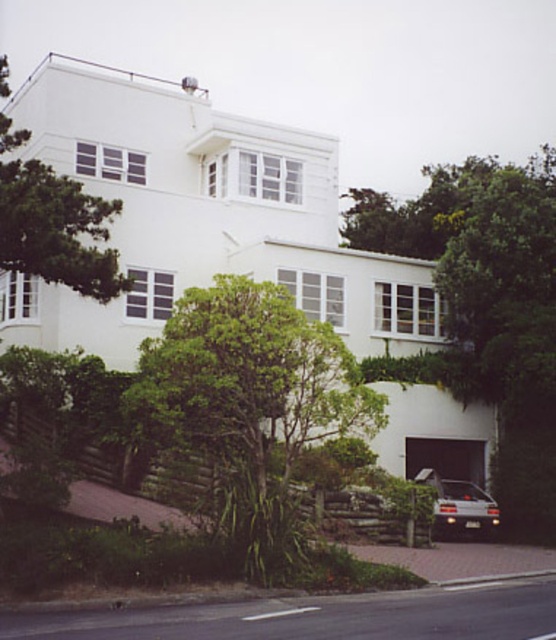
Which is in front, point (220, 458) or point (456, 513)?

Point (220, 458) is more forward.

Can you confirm if green leafy tree at center is smaller than silver metallic car at lower right?

Yes, green leafy tree at center is smaller than silver metallic car at lower right.

Is point (176, 403) more distant than point (434, 513)?

That is False.

Find the location of `green leafy tree at center`. green leafy tree at center is located at coordinates (250, 394).